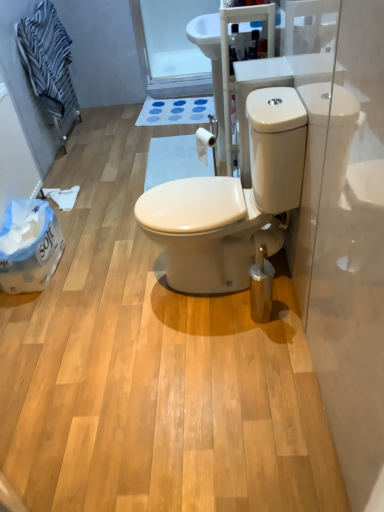
In order to click on free spot to the right of white plastic bag at left in this screenshot , I will do `click(94, 260)`.